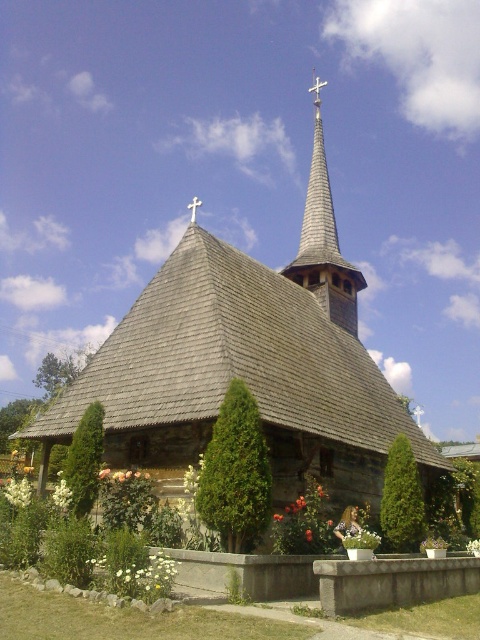
Question: Can you confirm if green leafy bush at center is bigger than white wooden cross at upper center?

Choices:
 (A) no
 (B) yes

Answer: (A)

Question: Is green textured bush at center below white wooden cross at upper center?

Choices:
 (A) yes
 (B) no

Answer: (A)

Question: Which of these objects is positioned closest to the wooden shingles at center?

Choices:
 (A) white wooden cross at upper center
 (B) green textured bush at center
 (C) green leafy bush at center
 (D) wooden spire at upper center

Answer: (A)

Question: Based on their relative distances, which object is farther from the white wooden cross at upper center?

Choices:
 (A) green leafy bush at lower left
 (B) wooden spire at upper center
 (C) green leafy bush at center

Answer: (B)

Question: Which point is closer to the camera?

Choices:
 (A) (74, 484)
 (B) (388, 492)
 (C) (180, 346)

Answer: (A)

Question: Can you confirm if wooden spire at upper center is thinner than green leafy bush at center?

Choices:
 (A) yes
 (B) no

Answer: (B)